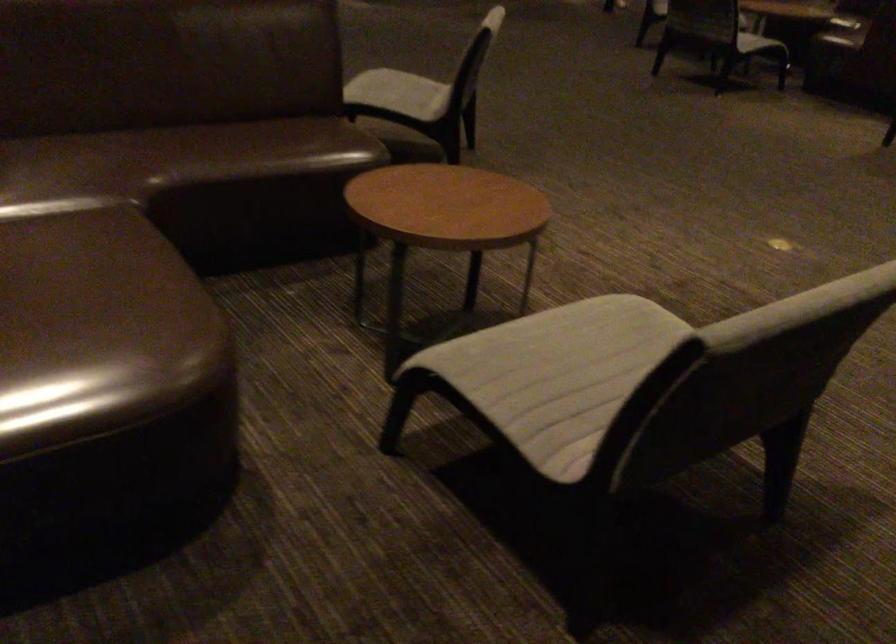
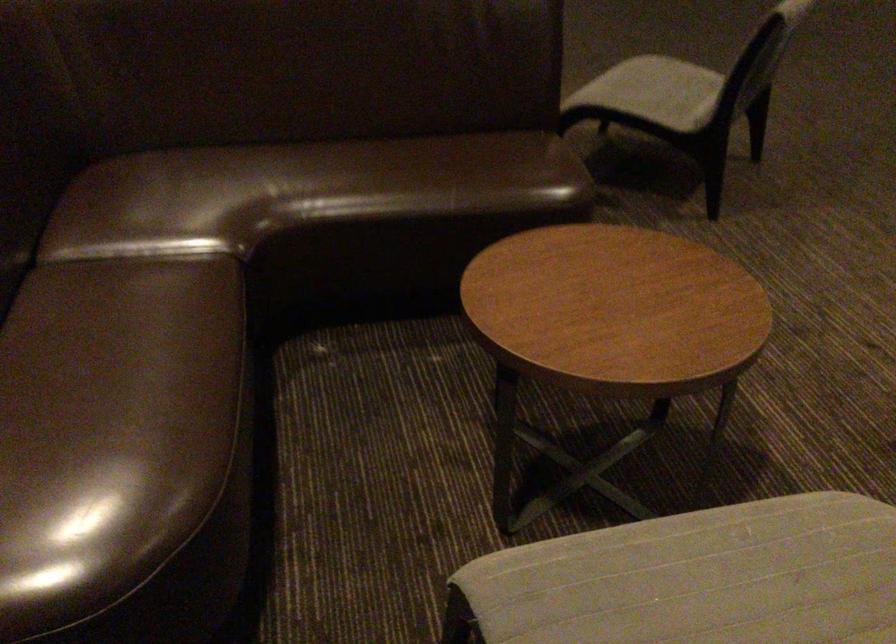
In the second image, find the point that corresponds to (143,296) in the first image.

(112, 426)